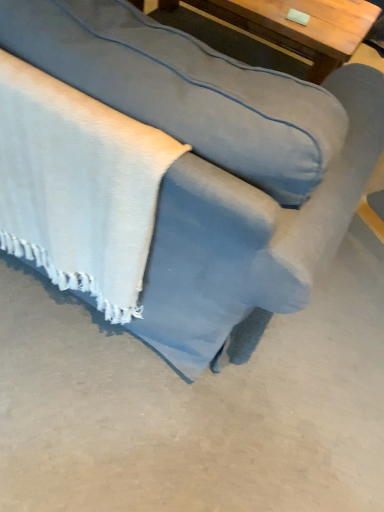
Question: Considering the positions of wooden table at upper center and white textured blanket at lower left in the image, is wooden table at upper center bigger or smaller than white textured blanket at lower left?

Choices:
 (A) big
 (B) small

Answer: (A)

Question: From a real-world perspective, is wooden table at upper center physically located above or below white textured blanket at lower left?

Choices:
 (A) above
 (B) below

Answer: (B)

Question: Which object is positioned farthest from the white textured blanket at lower left?

Choices:
 (A) wooden table at upper center
 (B) suede-like blue couch at center

Answer: (A)

Question: Estimate the real-world distances between objects in this image. Which object is farther from the white textured blanket at lower left?

Choices:
 (A) suede-like blue couch at center
 (B) wooden table at upper center

Answer: (B)